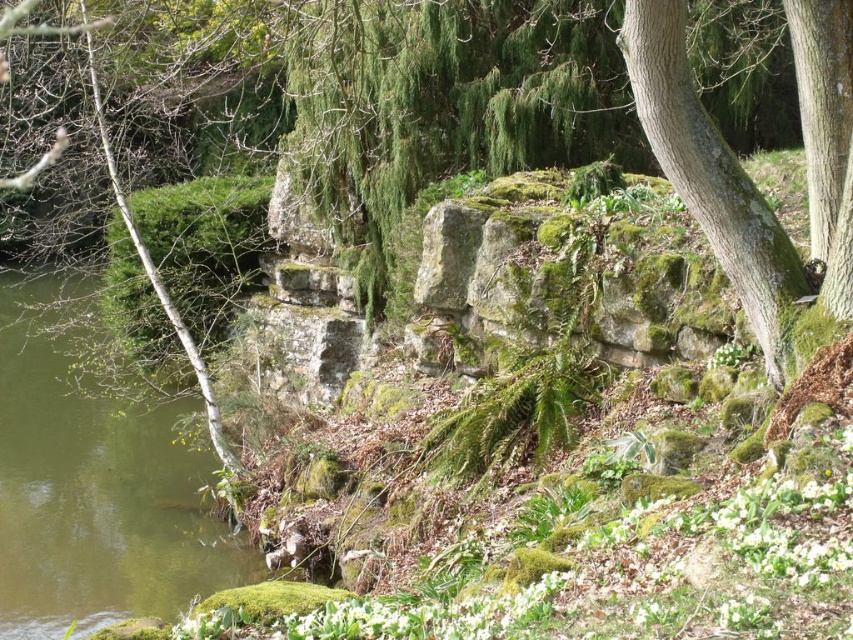
Question: Which point is farther to the camera?

Choices:
 (A) green liquid water at left
 (B) green rough bark tree at right

Answer: (A)

Question: Which object is closer to the camera taking this photo?

Choices:
 (A) green liquid water at left
 (B) green rough bark tree at right

Answer: (B)

Question: Is green liquid water at left thinner than green rough bark tree at right?

Choices:
 (A) no
 (B) yes

Answer: (A)

Question: Does green liquid water at left appear on the left side of green rough bark tree at right?

Choices:
 (A) yes
 (B) no

Answer: (A)

Question: Can you confirm if green liquid water at left is positioned to the left of green rough bark tree at right?

Choices:
 (A) no
 (B) yes

Answer: (B)